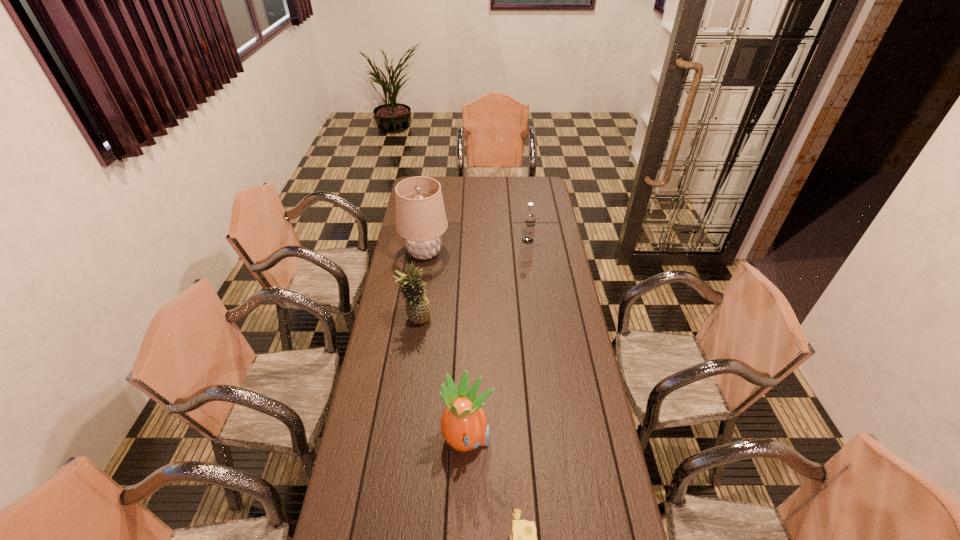
What are the coordinates of `lampshade that is at the left edge` in the screenshot? It's located at (420, 213).

You are a GUI agent. You are given a task and a screenshot of the screen. Output one action in this format:
    pyautogui.click(x=<x>, y=<y>)
    Task: Click on the pineapple at the left edge
    
    Given the screenshot: What is the action you would take?
    pyautogui.click(x=418, y=310)

I want to click on object positioned at the right edge, so click(x=529, y=217).

Where is `vacant region at the far edge of the desktop`? Image resolution: width=960 pixels, height=540 pixels. vacant region at the far edge of the desktop is located at coordinates click(451, 178).

Locate an element on the screen. This screenshot has height=540, width=960. vacant area at the right edge of the desktop is located at coordinates (559, 254).

Image resolution: width=960 pixels, height=540 pixels. I want to click on free location at the far right corner of the desktop, so click(x=530, y=192).

Identify the location of vacant point located between the rightmost object and the lampshade. The image size is (960, 540). (476, 247).

This screenshot has height=540, width=960. I want to click on free space between the right pineapple and the farther pineapple, so [442, 380].

Locate an element on the screen. The width and height of the screenshot is (960, 540). empty space that is in between the third object from right to left and the rightmost object is located at coordinates (497, 340).

Identify the location of free spot between the third nearest object and the vodka. (471, 280).